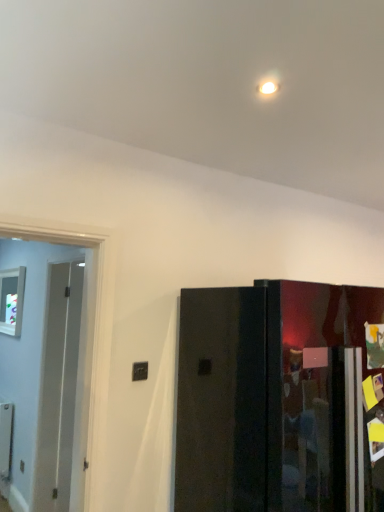
This screenshot has width=384, height=512. Describe the element at coordinates (12, 300) in the screenshot. I see `transparent glass window at left` at that location.

Measure the distance between glossy black refrigerator at right, the 2th door in the left-to-right sequence, and camera.

glossy black refrigerator at right, the 2th door in the left-to-right sequence, and camera are 1.70 meters apart.

Image resolution: width=384 pixels, height=512 pixels. I want to click on white glossy door at left, the first door in the left-to-right sequence, so click(x=54, y=366).

You are a GUI agent. You are given a task and a screenshot of the screen. Output one action in this format:
    pyautogui.click(x=<x>, y=<y>)
    Task: Click on the transparent glass window at left
    
    Given the screenshot: What is the action you would take?
    pyautogui.click(x=12, y=300)

Measure the distance from transparent glass window at left to white glossy door at left, the second door in the right-to-left sequence.

53.86 centimeters.

Is transparent glass window at left aimed at white glossy door at left, the first door in the left-to-right sequence?

No, transparent glass window at left is not facing towards white glossy door at left, the first door in the left-to-right sequence.

Can you see transparent glass window at left touching white glossy door at left, the first door in the left-to-right sequence?

No, transparent glass window at left is not touching white glossy door at left, the first door in the left-to-right sequence.

What's the angular difference between transparent glass window at left and glossy black refrigerator at right, the 2th door in the left-to-right sequence,'s facing directions?

They differ by 89.8 degrees in their facing directions.

Considering the positions of point (15, 282) and point (293, 456), is point (15, 282) closer or farther from the camera than point (293, 456)?

Point (15, 282).

Is transparent glass window at left oriented towards glossy black refrigerator at right, the 2th door in the left-to-right sequence?

No, transparent glass window at left is not aimed at glossy black refrigerator at right, the 2th door in the left-to-right sequence.

Between transparent glass window at left and glossy black refrigerator at right, the 2th door in the left-to-right sequence, which one has less height?

Standing shorter between the two is transparent glass window at left.

From a real-world perspective, is glossy black refrigerator at right, which is the 1th door from right to left, under white glossy door at left, the second door in the right-to-left sequence?

Yes, from a real-world perspective, glossy black refrigerator at right, which is the 1th door from right to left, is below white glossy door at left, the second door in the right-to-left sequence.

Considering the relative sizes of glossy black refrigerator at right, which is the 1th door from right to left, and white glossy door at left, the first door in the left-to-right sequence, in the image provided, is glossy black refrigerator at right, which is the 1th door from right to left, shorter than white glossy door at left, the first door in the left-to-right sequence,?

No.

Is point (238, 482) closer or farther from the camera than point (80, 268)?

Point (238, 482) is closer to the camera than point (80, 268).

Is glossy black refrigerator at right, the 2th door in the left-to-right sequence, aimed at white glossy door at left, the second door in the right-to-left sequence?

No, glossy black refrigerator at right, the 2th door in the left-to-right sequence, is not turned towards white glossy door at left, the second door in the right-to-left sequence.

Where is `window above the glossy black refrigerator at right, the 2th door in the left-to-right sequence (from the image's perspective)`? window above the glossy black refrigerator at right, the 2th door in the left-to-right sequence (from the image's perspective) is located at coordinates (12, 300).

Is glossy black refrigerator at right, the 2th door in the left-to-right sequence, to the left or to the right of transparent glass window at left in the image?

In the image, glossy black refrigerator at right, the 2th door in the left-to-right sequence, appears on the right side of transparent glass window at left.

From a real-world perspective, is glossy black refrigerator at right, which is the 1th door from right to left, on transparent glass window at left?

No, from a real-world perspective, glossy black refrigerator at right, which is the 1th door from right to left, is not over transparent glass window at left

Does point (81, 510) appear closer or farther from the camera than point (20, 276)?

Point (81, 510) is positioned closer to the camera compared to point (20, 276).

Is white glossy door at left, the first door in the left-to-right sequence, not close to transparent glass window at left?

They are positioned close to each other.

From the image's perspective, which one is positioned higher, white glossy door at left, the second door in the right-to-left sequence, or transparent glass window at left?

transparent glass window at left is shown above in the image.

Consider the image. Looking at the image, does white glossy door at left, the first door in the left-to-right sequence, seem bigger or smaller compared to transparent glass window at left?

In the image, white glossy door at left, the first door in the left-to-right sequence, appears to be larger than transparent glass window at left.

Could you tell me if white glossy door at left, the second door in the right-to-left sequence, is turned towards glossy black refrigerator at right, the 2th door in the left-to-right sequence?

No.

Considering the points (42, 292) and (295, 510), which point is in front, point (42, 292) or point (295, 510)?

The point (295, 510) is closer.

From the image's perspective, which object appears higher, white glossy door at left, the first door in the left-to-right sequence, or glossy black refrigerator at right, the 2th door in the left-to-right sequence?

white glossy door at left, the first door in the left-to-right sequence, from the image's perspective.

From a real-world perspective, count 1st doors downward from the transparent glass window at left and point to it. Please provide its 2D coordinates.

[(54, 366)]

At what (x,y) coordinates should I click in order to perform the action: click on window on the left of glossy black refrigerator at right, which is the 1th door from right to left. Please return your answer as a coordinate pair (x, y). The image size is (384, 512). Looking at the image, I should click on (12, 300).

Considering their positions, is transparent glass window at left positioned closer to glossy black refrigerator at right, the 2th door in the left-to-right sequence, than white glossy door at left, the second door in the right-to-left sequence?

white glossy door at left, the second door in the right-to-left sequence, is closer to glossy black refrigerator at right, the 2th door in the left-to-right sequence.

Considering their positions, is white glossy door at left, the second door in the right-to-left sequence, positioned further to transparent glass window at left than glossy black refrigerator at right, which is the 1th door from right to left?

glossy black refrigerator at right, which is the 1th door from right to left, lies further to transparent glass window at left than the other object.

Considering their positions, is transparent glass window at left positioned further to white glossy door at left, the second door in the right-to-left sequence, than glossy black refrigerator at right, the 2th door in the left-to-right sequence?

The object further to white glossy door at left, the second door in the right-to-left sequence, is glossy black refrigerator at right, the 2th door in the left-to-right sequence.

When comparing their distances from transparent glass window at left, does glossy black refrigerator at right, the 2th door in the left-to-right sequence, or white glossy door at left, the second door in the right-to-left sequence, seem closer?

The object closer to transparent glass window at left is white glossy door at left, the second door in the right-to-left sequence.

When comparing their distances from glossy black refrigerator at right, which is the 1th door from right to left, does white glossy door at left, the second door in the right-to-left sequence, or transparent glass window at left seem further?

Among the two, transparent glass window at left is located further to glossy black refrigerator at right, which is the 1th door from right to left.

When comparing their distances from white glossy door at left, the first door in the left-to-right sequence, does glossy black refrigerator at right, which is the 1th door from right to left, or transparent glass window at left seem further?

glossy black refrigerator at right, which is the 1th door from right to left, is further to white glossy door at left, the first door in the left-to-right sequence.

Where is `door positioned between glossy black refrigerator at right, the 2th door in the left-to-right sequence, and transparent glass window at left from near to far`? door positioned between glossy black refrigerator at right, the 2th door in the left-to-right sequence, and transparent glass window at left from near to far is located at coordinates (54, 366).